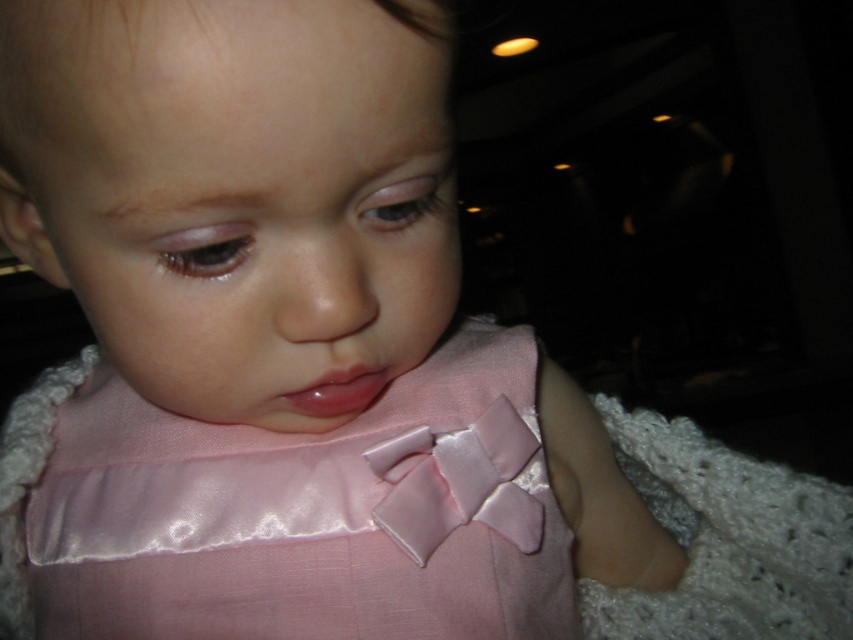
Can you confirm if satin pink dress at center is positioned below glossy pink lips at center?

Yes.

Is satin pink dress at center wider than glossy pink lips at center?

Correct, the width of satin pink dress at center exceeds that of glossy pink lips at center.

Is point (318, 547) positioned before point (323, 385)?

No, it is behind (323, 385).

At what (x,y) coordinates should I click in order to perform the action: click on satin pink dress at center. Please return your answer as a coordinate pair (x, y). Looking at the image, I should click on (288, 513).